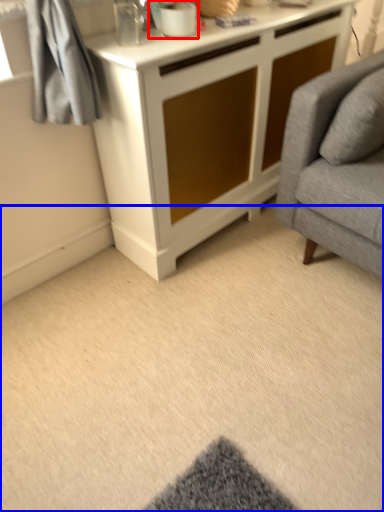
Question: Which of the following is the farthest to the observer, appliance (highlighted by a red box) or plain (highlighted by a blue box)?

Choices:
 (A) appliance
 (B) plain

Answer: (A)